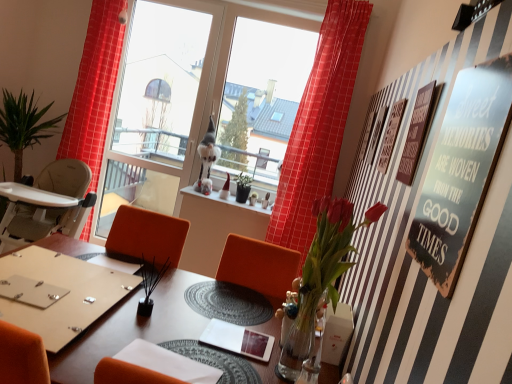
This screenshot has width=512, height=384. I want to click on empty space that is ontop of wooden table at center (from a real-world perspective), so click(180, 316).